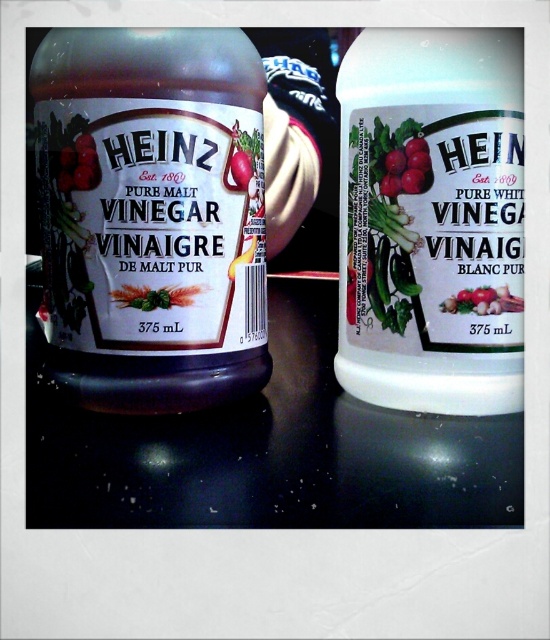
You are a chef preparing a dish and need to choose between the matte glass bottle at left and the red glossy radish at center. Which one is taller?

The matte glass bottle at left is taller than the red glossy radish at center.

You are a customer at a store and want to compare the two bottles of Heinz vinegar. Which one is taller, the white matte bottle at center or the red glossy radish at center?

The white matte bottle at center is taller than the red glossy radish at center according to the description.

You are organizing a pantry and see the matte glass bottle at left and the white matte bottle at center. Which one should you place on the leftmost shelf to maintain their current arrangement?

You should place the matte glass bottle at left on the leftmost shelf because it is already positioned to the left of the white matte bottle at center in the current setup.